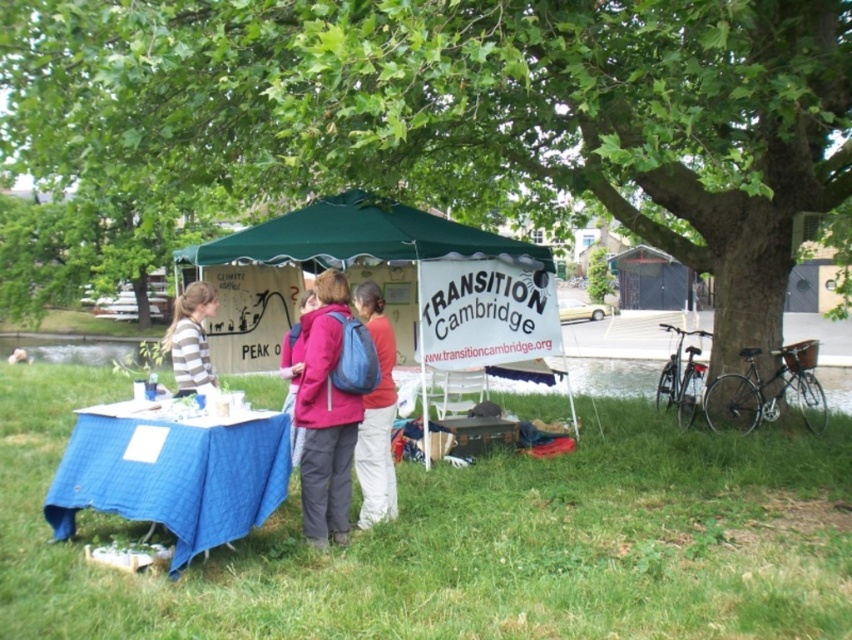
Question: Which point appears closest to the camera in this image?

Choices:
 (A) [78, 554]
 (B) [315, 445]
 (C) [367, 284]

Answer: (A)

Question: Is green fabric tent at center above striped cotton shirt at left?

Choices:
 (A) yes
 (B) no

Answer: (A)

Question: Does green fabric tent at center appear on the right side of matte blue backpack at center?

Choices:
 (A) yes
 (B) no

Answer: (B)

Question: Which is farther from the blue fabric table at lower left?

Choices:
 (A) green leafy tree at upper center
 (B) striped cotton shirt at left
 (C) matte pink jacket at center
 (D) green grass at lower center

Answer: (A)

Question: Observing the image, what is the correct spatial positioning of green fabric tent at center in reference to striped cotton shirt at left?

Choices:
 (A) right
 (B) left

Answer: (A)

Question: Which of these objects is positioned closest to the green fabric tent at center?

Choices:
 (A) green grass at lower center
 (B) matte blue backpack at center

Answer: (B)